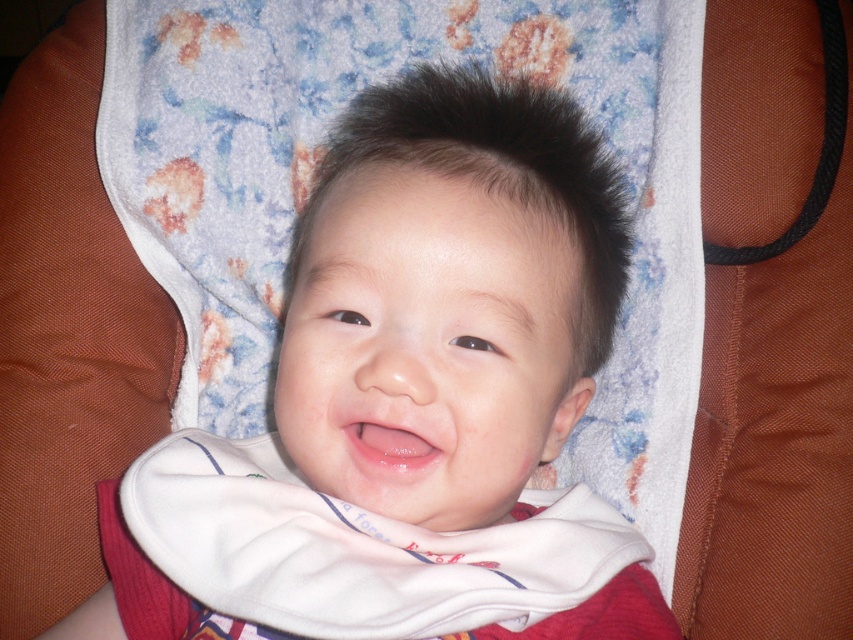
Question: Is white soft bib at center positioned before pink glossy lips at center?

Choices:
 (A) no
 (B) yes

Answer: (B)

Question: Among these objects, which one is farthest from the camera?

Choices:
 (A) pink glossy lips at center
 (B) white soft bib at center

Answer: (A)

Question: Can you confirm if white soft bib at center is smaller than white cotton bib at center?

Choices:
 (A) yes
 (B) no

Answer: (B)

Question: Based on their relative distances, which object is nearer to the white soft bib at center?

Choices:
 (A) pink glossy lips at center
 (B) white cotton bib at center

Answer: (B)

Question: Can you confirm if white soft bib at center is thinner than white cotton bib at center?

Choices:
 (A) no
 (B) yes

Answer: (A)

Question: Which object is positioned closest to the pink glossy lips at center?

Choices:
 (A) white soft bib at center
 (B) white cotton bib at center

Answer: (B)